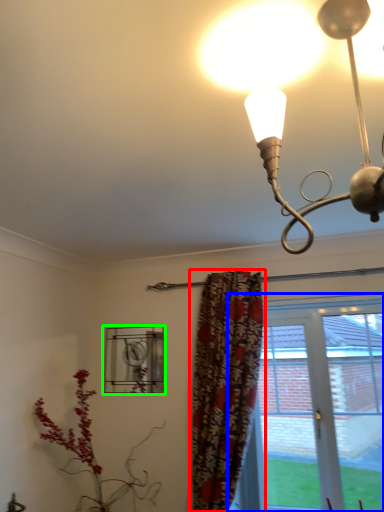
Question: Which is farther away from curtain (highlighted by a red box)? window (highlighted by a blue box) or window (highlighted by a green box)?

Choices:
 (A) window
 (B) window

Answer: (B)